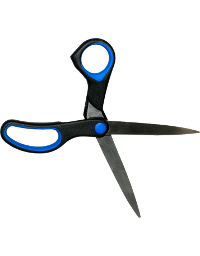
I want to click on black plastic handles, so click(x=100, y=92), click(x=85, y=127).